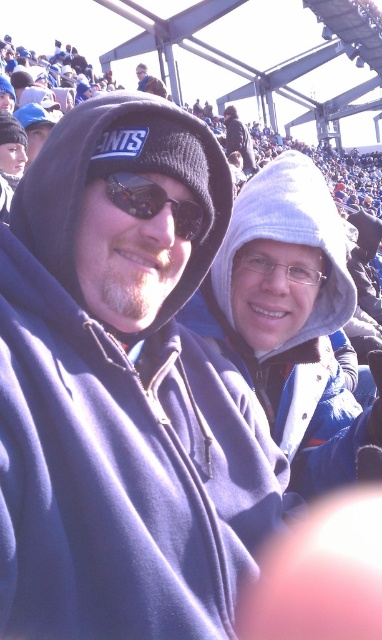
You are at the stadium and want to place both the clear plastic glasses at center and the white fleece hat at center on a narrow shelf. Which object should you place first to ensure both fit on the shelf?

The clear plastic glasses at center has a smaller width than the white fleece hat at center, so you should place the white fleece hat at center first to make space for the narrower glasses.

You are standing at the edge of the stadium stands. There is a point marked at coordinates point (184, 200). If you want to throw a small ball to hit that point, considering your maximum throwing distance is 30 meters, will you be able to reach it?

The point (184, 200) is 34.18 meters away from the viewer. Since your maximum throwing distance is 30 meters, you cannot reach it.

You are standing in the stadium and want to determine which of the two points, point (64, 182) or point (226, 141), is nearer to you. Based on the scene description, which point is closer?

Point (64, 182) is closer to the viewer than point (226, 141).